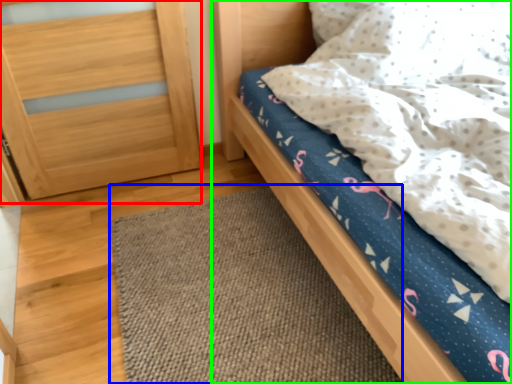
Question: Which object is the farthest from balustrade (highlighted by a red box)? Choose among these: mat (highlighted by a blue box) or bed (highlighted by a green box).

Choices:
 (A) mat
 (B) bed

Answer: (A)